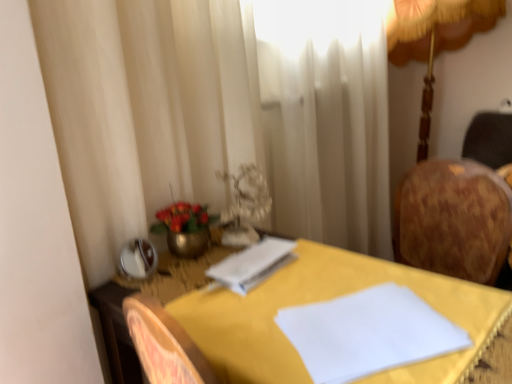
Identify the location of free space above yellow fabric-covered table at center (from a real-world perspective). (304, 299).